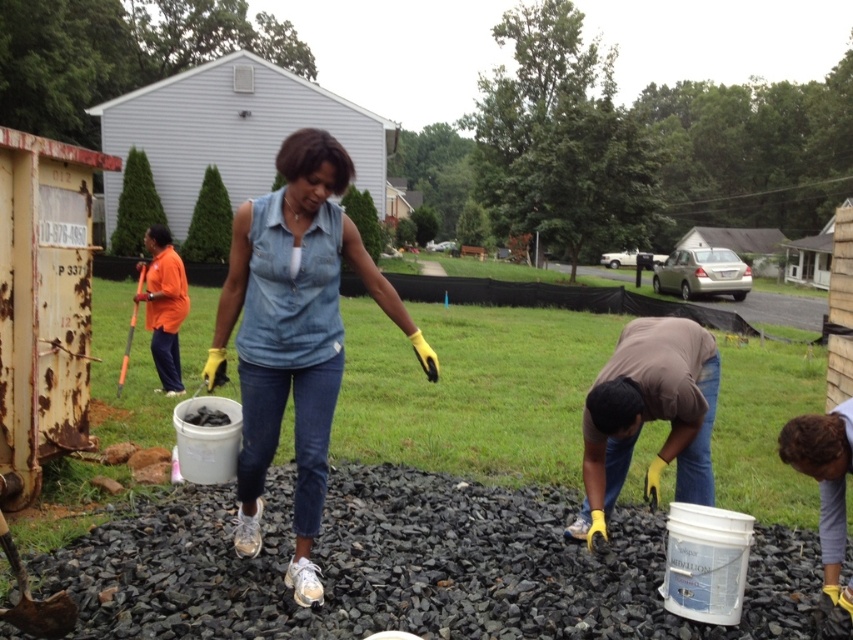
You are standing at the edge of the scene and want to walk towards the black gravel at center without stepping on the curly hair at lower right. Which direction should you walk?

The black gravel at center is in front of curly hair at lower right, so you should walk forward towards the black gravel at center to avoid stepping on the curly hair at lower right.

What are the coordinates of the denim shirt at center in the image?

The denim shirt at center is located at coordinates point (x=294, y=333).